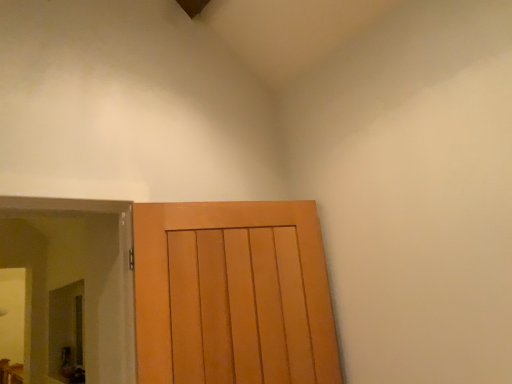
The height and width of the screenshot is (384, 512). Describe the element at coordinates (221, 227) in the screenshot. I see `light brown wood door at center` at that location.

Locate an element on the screen. Image resolution: width=512 pixels, height=384 pixels. light brown wood door at center is located at coordinates (x=221, y=227).

You are a GUI agent. You are given a task and a screenshot of the screen. Output one action in this format:
    pyautogui.click(x=<x>, y=<y>)
    Task: Click on the light brown wood door at center
    The height and width of the screenshot is (384, 512).
    Given the screenshot: What is the action you would take?
    pyautogui.click(x=221, y=227)